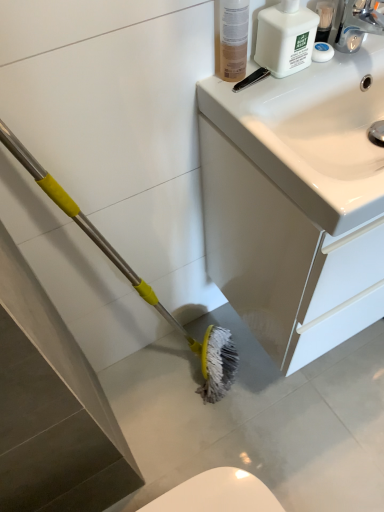
Question: Is white glossy sink at upper right in front of or behind white plastic bottle at upper right in the image?

Choices:
 (A) front
 (B) behind

Answer: (A)

Question: Considering the positions of point (377, 276) and point (276, 75), is point (377, 276) closer or farther from the camera than point (276, 75)?

Choices:
 (A) closer
 (B) farther

Answer: (B)

Question: Based on their relative distances, which object is nearer to the white plastic bottle at upper right?

Choices:
 (A) translucent plastic bottle at upper right
 (B) white glossy sink at upper right

Answer: (A)

Question: Which object is positioned farthest from the white plastic bottle at upper right?

Choices:
 (A) translucent plastic bottle at upper right
 (B) white glossy sink at upper right

Answer: (B)